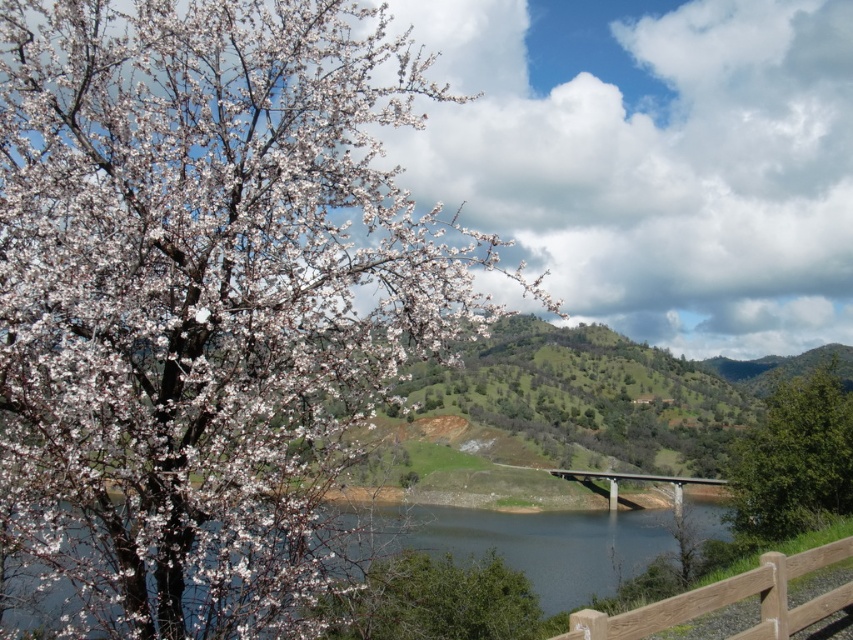
You are standing at the edge of the water and want to walk to the gray concrete bridge at center. Which direction should you walk to avoid the brown wooden fence at lower right?

To reach the gray concrete bridge at center while avoiding the brown wooden fence at lower right, walk towards the center of the image, as the brown wooden fence at lower right is positioned over the bridge and may block direct access.

You are a painter planning to sketch the scene. You want to ensure the brown wooden fence at lower right and the gray concrete bridge at center are proportionally accurate. Which one should you draw with a thinner line to maintain the correct proportions?

The brown wooden fence at lower right is thinner than the gray concrete bridge at center, so you should draw the brown wooden fence at lower right with a thinner line to maintain the correct proportions.